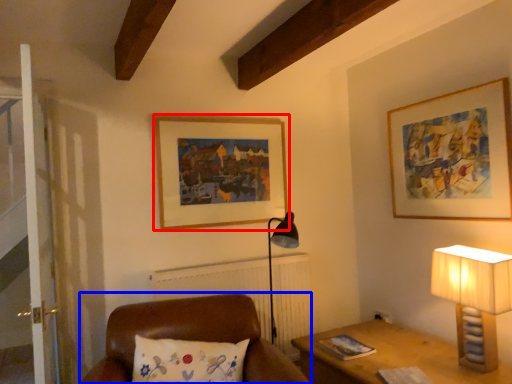
Question: Among these objects, which one is farthest to the camera, picture frame (highlighted by a red box) or furniture (highlighted by a blue box)?

Choices:
 (A) picture frame
 (B) furniture

Answer: (A)